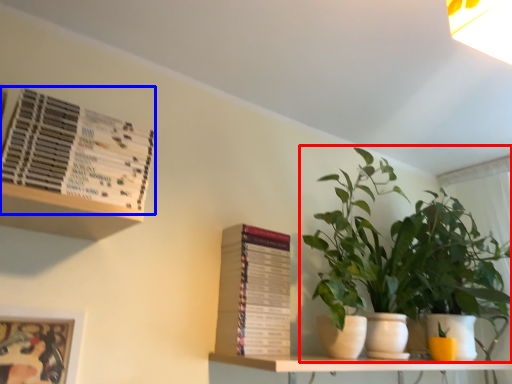
Question: Which object is closer to the camera taking this photo, houseplant (highlighted by a red box) or paperback book (highlighted by a blue box)?

Choices:
 (A) houseplant
 (B) paperback book

Answer: (B)